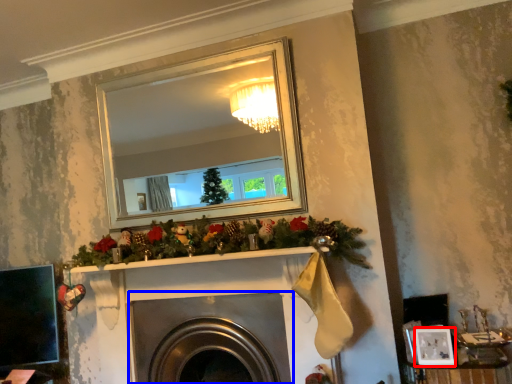
Question: Which point is further to the camera, picture frame (highlighted by a red box) or fireplace (highlighted by a blue box)?

Choices:
 (A) picture frame
 (B) fireplace

Answer: (B)